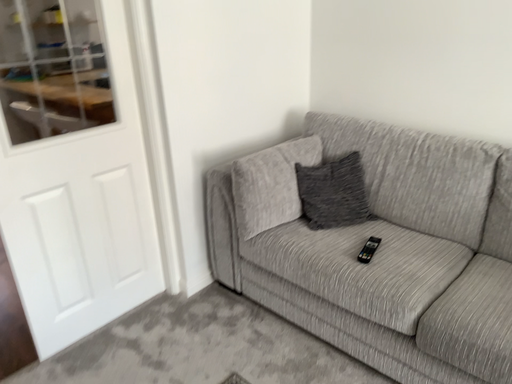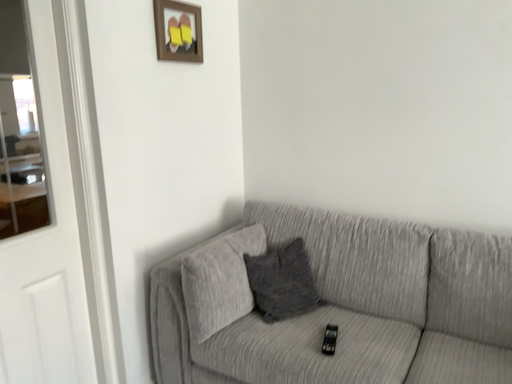
Question: Which way did the camera rotate in the video?

Choices:
 (A) rotated right
 (B) rotated left

Answer: (A)